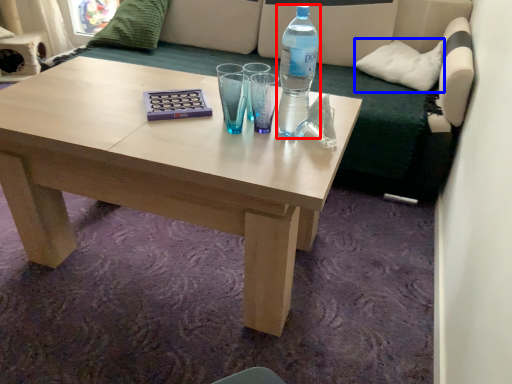
Question: Which point is further to the camera, bottle (highlighted by a red box) or pillow (highlighted by a blue box)?

Choices:
 (A) bottle
 (B) pillow

Answer: (B)